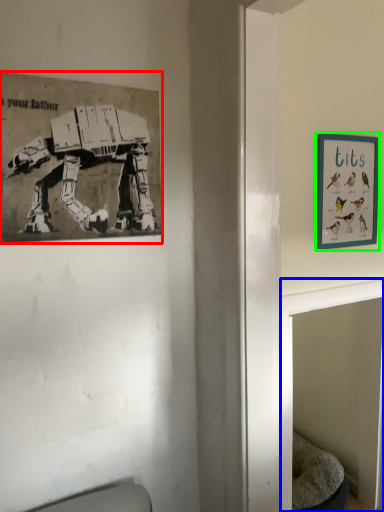
Question: Estimate the real-world distances between objects in this image. Which object is closer to picture frame (highlighted by a red box), table (highlighted by a blue box) or picture frame (highlighted by a green box)?

Choices:
 (A) table
 (B) picture frame

Answer: (A)